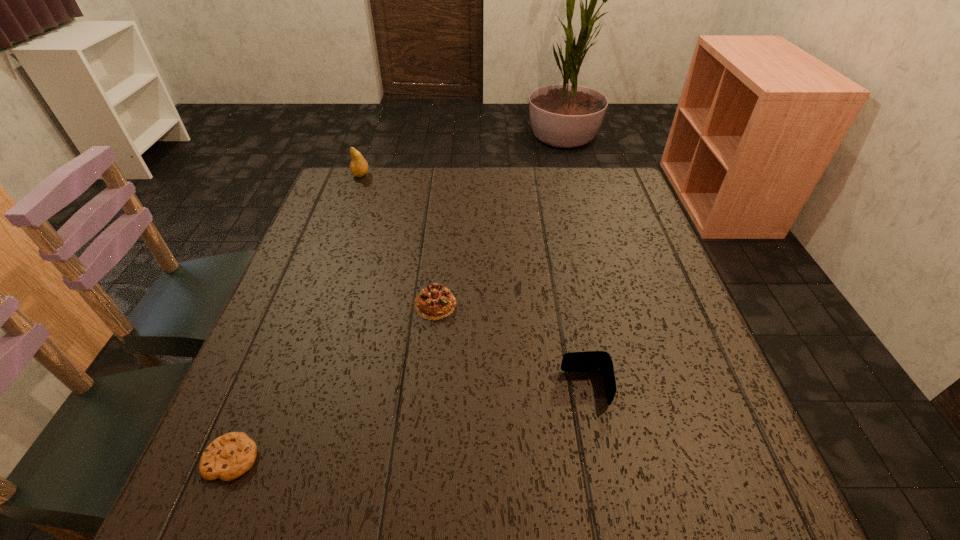
Where is `unoccupied area between the third object from left to right and the second nearest object`? unoccupied area between the third object from left to right and the second nearest object is located at coordinates (510, 346).

Where is `free spot between the wallet and the second shortest object`? This screenshot has width=960, height=540. free spot between the wallet and the second shortest object is located at coordinates (510, 346).

I want to click on vacant space in between the chocolate cake and the farthest object, so click(x=397, y=240).

Image resolution: width=960 pixels, height=540 pixels. Find the location of `vacant region between the third tallest object and the farthest object`. vacant region between the third tallest object and the farthest object is located at coordinates (397, 240).

Image resolution: width=960 pixels, height=540 pixels. Identify the location of free space between the shortest object and the third object from left to right. (333, 381).

Identify which object is the nearest to the wallet. Please provide its 2D coordinates. Your answer should be formatted as a tuple, i.e. [(x, y)], where the tuple contains the x and y coordinates of a point satisfying the conditions above.

[(435, 302)]

Choose which object is the nearest neighbor to the cookie. Please provide its 2D coordinates. Your answer should be formatted as a tuple, i.e. [(x, y)], where the tuple contains the x and y coordinates of a point satisfying the conditions above.

[(435, 302)]

At what (x,y) coordinates should I click in order to perform the action: click on free space that satisfies the following two spatial constraints: 1. on the back side of the cookie; 2. on the right side of the chocolate cake. Please return your answer as a coordinate pair (x, y). Image resolution: width=960 pixels, height=540 pixels. Looking at the image, I should click on (295, 304).

At what (x,y) coordinates should I click in order to perform the action: click on blank area in the image that satisfies the following two spatial constraints: 1. on the back side of the nearest object; 2. on the left side of the third tallest object. Please return your answer as a coordinate pair (x, y). The image size is (960, 540). Looking at the image, I should click on (295, 304).